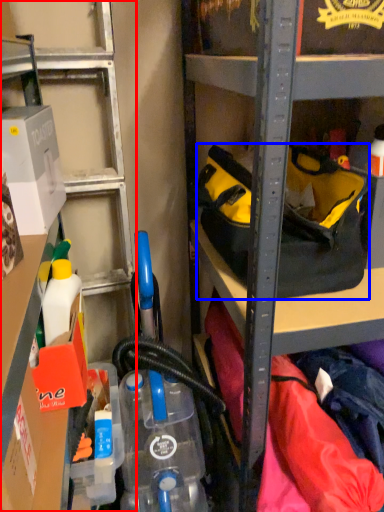
Question: Which object appears closest to the camera in this image, shelf (highlighted by a red box) or handbag (highlighted by a blue box)?

Choices:
 (A) shelf
 (B) handbag

Answer: (A)